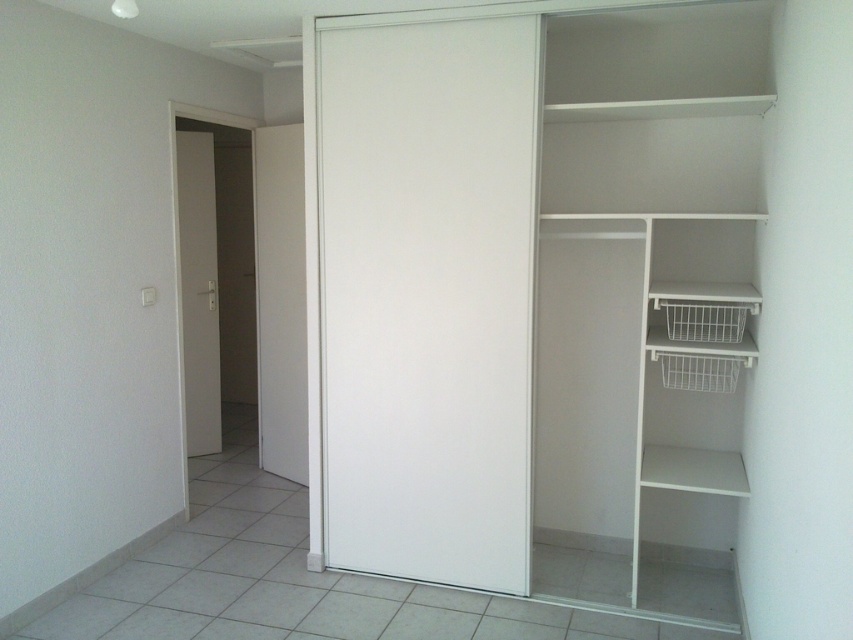
You are trying to decide which door to use to enter the hallway. Both the white smooth door at left and the white matte door at left are in front of you. Which one is taller?

The white smooth door at left is taller than the white matte door at left.

You are a delivery person trying to navigate through a hallway. You need to pass through the white matte sliding door at center and the white matte door at left. Given that the distance between them is 7.05 feet, can you estimate if a standard delivery cart that is 2.5 feet wide can fit through the space between them without touching either door?

The distance between the white matte sliding door at center and the white matte door at left is 7.05 feet. Since the delivery cart is only 2.5 feet wide, there is ample space for it to pass through without touching either door.

You are trying to decide which door to use to exit the room. The white matte sliding door at center and the white smooth door at left are both exits. Which door has a wider opening to pass through?

The white matte sliding door at center has a larger width than the white smooth door at left, so it has a wider opening to pass through.